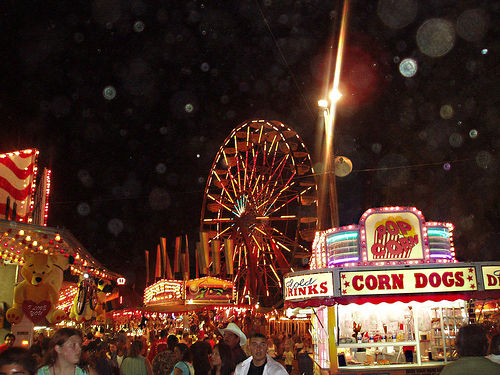
Locate an element on the screen. counter is located at coordinates (419, 366).